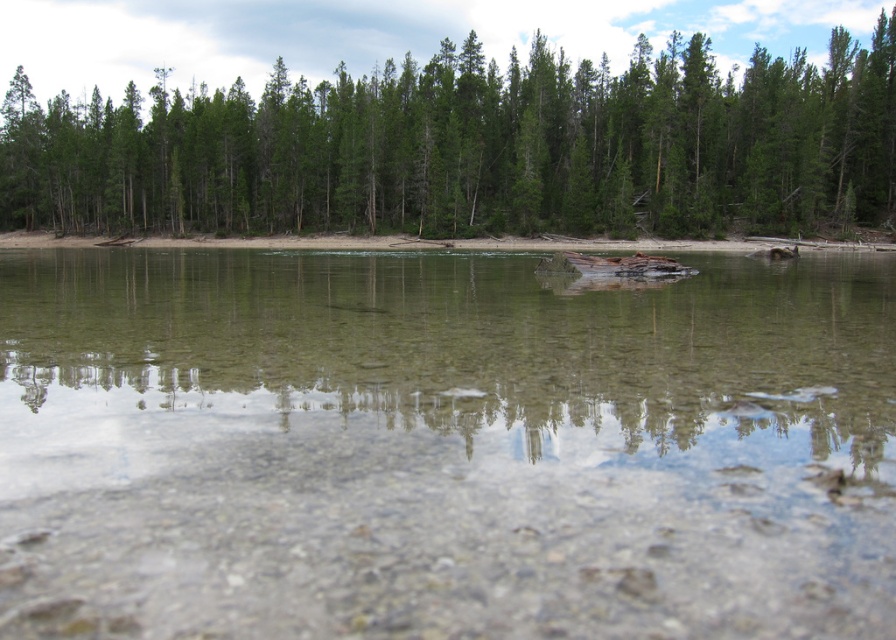
Who is more forward, (826, 90) or (429, 243)?

Point (429, 243)

Is point (105, 156) in front of point (2, 244)?

No, it is behind (2, 244).

Is point (467, 212) farther from camera compared to point (708, 248)?

Yes, point (467, 212) is behind point (708, 248).

Locate an element on the screen. green matte trees at upper center is located at coordinates (474, 147).

Is clear glass water at center positioned before brown dirt shoreline at center?

That is True.

Between clear glass water at center and brown dirt shoreline at center, which one is positioned higher?

brown dirt shoreline at center

This screenshot has width=896, height=640. I want to click on clear glass water at center, so click(442, 448).

Is clear glass water at center to the left of green matte trees at upper center from the viewer's perspective?

Incorrect, clear glass water at center is not on the left side of green matte trees at upper center.

Who is more distant from viewer, [480,260] or [324,97]?

Point [324,97]

The height and width of the screenshot is (640, 896). In order to click on clear glass water at center in this screenshot , I will do `click(442, 448)`.